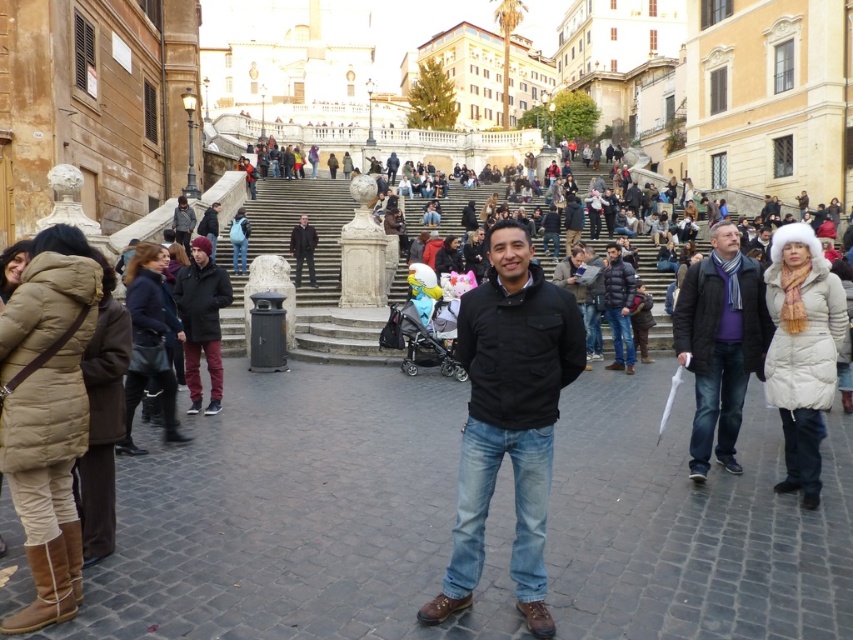
Question: Which point is farther to the camera?

Choices:
 (A) (485, 396)
 (B) (302, 236)
 (C) (608, 269)

Answer: (B)

Question: Considering the relative positions of dark blue puffer jacket at center and black leather jacket at upper center in the image provided, where is dark blue puffer jacket at center located with respect to black leather jacket at upper center?

Choices:
 (A) left
 (B) right

Answer: (B)

Question: Does black matte jacket at center have a lesser width compared to blue wool scarf at right?

Choices:
 (A) no
 (B) yes

Answer: (A)

Question: Which of the following is the farthest from the observer?

Choices:
 (A) blue wool scarf at right
 (B) black leather jacket at upper center

Answer: (B)

Question: Is dark blue puffer jacket at center wider than black leather jacket at upper center?

Choices:
 (A) yes
 (B) no

Answer: (A)

Question: Considering the real-world distances, which object is farthest from the black matte jacket at center?

Choices:
 (A) dark blue puffer jacket at center
 (B) blue wool scarf at right
 (C) black leather jacket at upper center

Answer: (C)